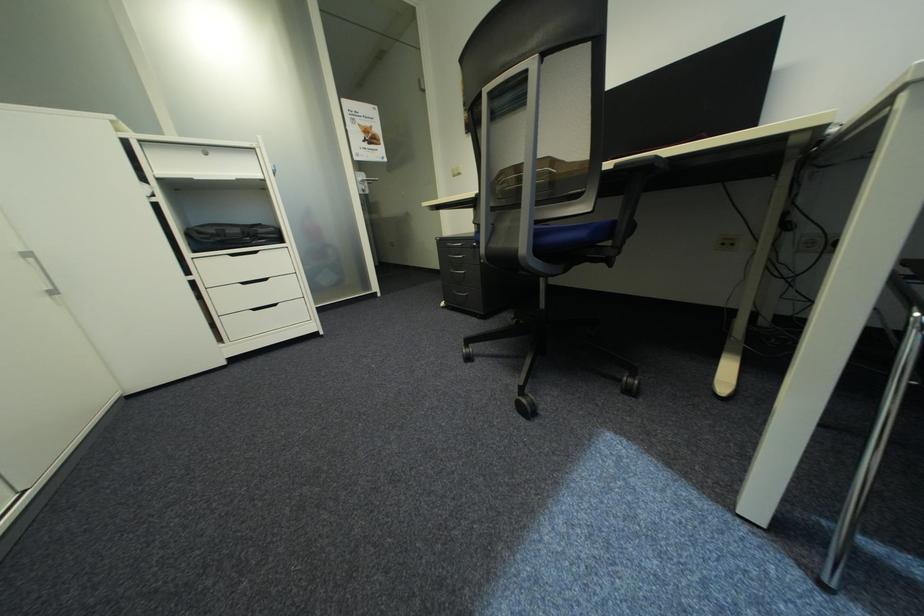
Find where to resting arm the black chair armrest. Please return your answer as a coordinate pair (x, y).

(646, 163)